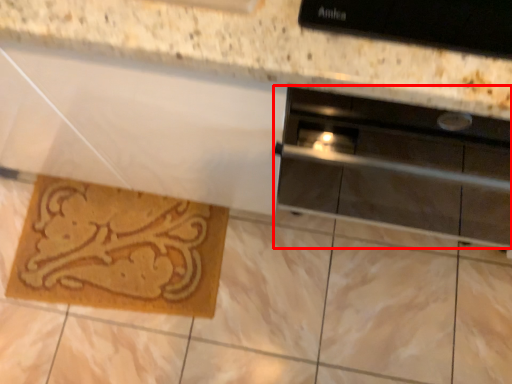
Question: From the image's perspective, where is home appliance (annotated by the red box) located relative to doormat?

Choices:
 (A) below
 (B) above

Answer: (B)